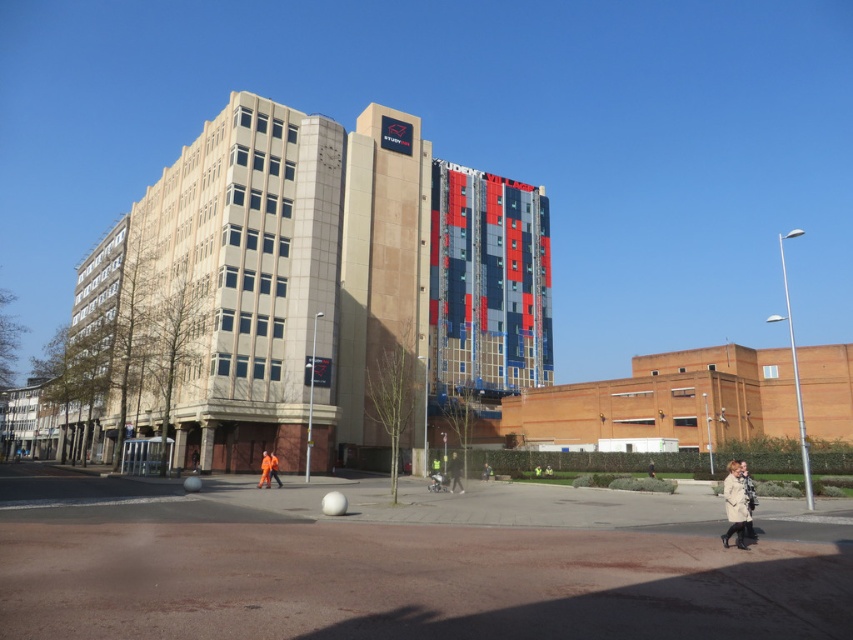
Which of these two, light brown leather coat at lower right or orange fabric person at center, stands shorter?

orange fabric person at center is shorter.

Does light brown leather coat at lower right have a lesser width compared to orange fabric person at center?

No.

Describe the element at coordinates (734, 504) in the screenshot. The width and height of the screenshot is (853, 640). I see `light brown leather coat at lower right` at that location.

Identify the location of light brown leather coat at lower right. (734, 504).

Which is below, yellow reflective vest at center or orange workwear at center?

yellow reflective vest at center is below.

Is point (456, 461) positioned after point (270, 468)?

Yes, it is behind point (270, 468).

Identify the location of yellow reflective vest at center. The image size is (853, 640). (454, 472).

Which is in front, point (729, 500) or point (274, 468)?

Point (729, 500)

Between light brown leather coat at lower right and orange workwear at center, which one has less height?

orange workwear at center

Locate an element on the screen. This screenshot has width=853, height=640. light brown leather coat at lower right is located at coordinates [734, 504].